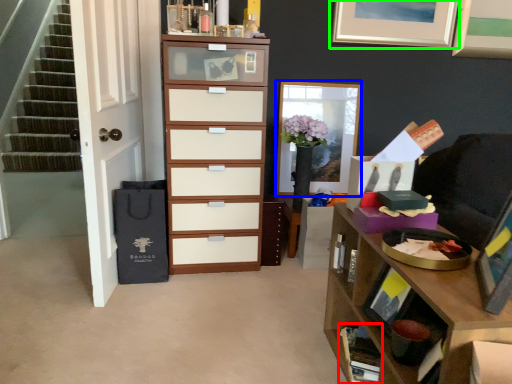
Question: Which object is positioned closest to cabinet (highlighted by a red box)? Select from picture frame (highlighted by a blue box) and picture frame (highlighted by a green box).

Choices:
 (A) picture frame
 (B) picture frame

Answer: (A)